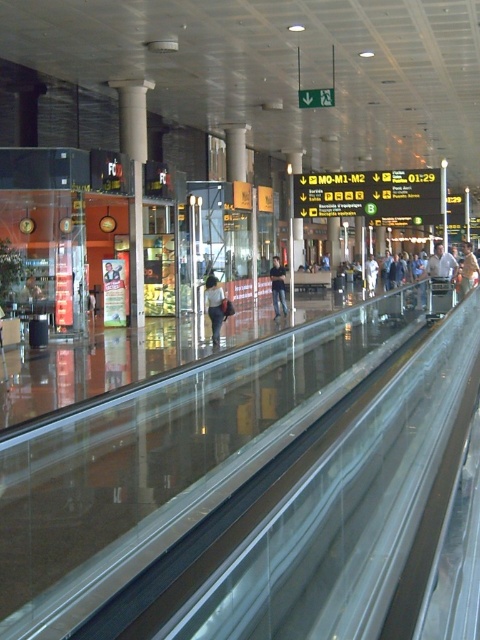
Question: Does light brown leather jacket at center have a smaller size compared to white fabric bag at center?

Choices:
 (A) yes
 (B) no

Answer: (B)

Question: Which object appears farthest from the camera in this image?

Choices:
 (A) light brown leather jacket at right
 (B) dark brown leather jacket at center

Answer: (A)

Question: Does light blue denim jeans at center appear on the right side of dark blue jeans at center?

Choices:
 (A) no
 (B) yes

Answer: (A)

Question: Which point appears farthest from the camera in this image?

Choices:
 (A) (0, 336)
 (B) (214, 296)
 (C) (116, 275)

Answer: (C)

Question: Which of the following is the farthest from the observer?

Choices:
 (A) (278, 273)
 (B) (216, 305)
 (C) (1, 314)
 (D) (31, 288)

Answer: (A)

Question: Is light brown leather jacket at center behind dark blue jeans at center?

Choices:
 (A) no
 (B) yes

Answer: (B)